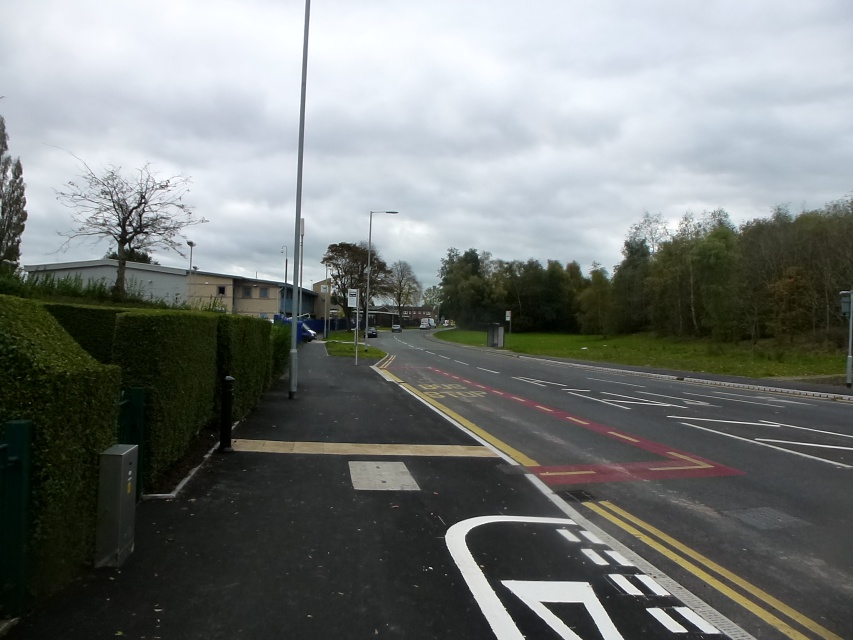
Question: Does green leafy hedge at left have a lesser width compared to green leafy hedge at center?

Choices:
 (A) yes
 (B) no

Answer: (A)

Question: Which point appears farthest from the camera in this image?

Choices:
 (A) (726, 321)
 (B) (281, 362)
 (C) (351, 292)

Answer: (A)

Question: Which point is closer to the camera?

Choices:
 (A) green leafy hedge at center
 (B) green leafy hedge at left

Answer: (B)

Question: Does green leafy hedge at left lie behind green leafy hedge at center?

Choices:
 (A) yes
 (B) no

Answer: (B)

Question: Where is green leafy hedge at left located in relation to green leafy hedge at center in the image?

Choices:
 (A) right
 (B) left

Answer: (B)

Question: Which point is closer to the camera?

Choices:
 (A) (606, 291)
 (B) (349, 292)
 (C) (260, 340)

Answer: (C)